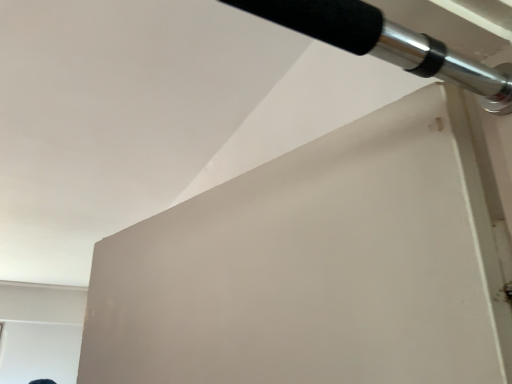
Describe the element at coordinates (385, 43) in the screenshot. I see `black rubberized handle at upper right` at that location.

Measure the distance between black rubberized handle at upper right and camera.

black rubberized handle at upper right is 9.84 inches away from camera.

Locate an element on the screen. This screenshot has width=512, height=384. black rubberized handle at upper right is located at coordinates (385, 43).

Find the location of a particular element. This screenshot has height=384, width=512. black rubberized handle at upper right is located at coordinates (385, 43).